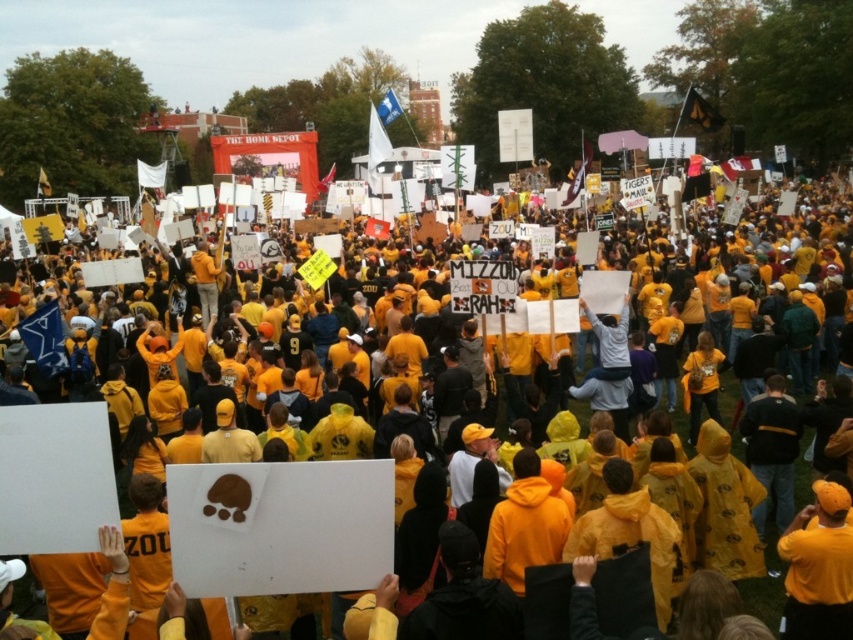
Is yellow matte raincoat at center bigger than light gray sweater at center?

Yes.

This screenshot has height=640, width=853. Describe the element at coordinates (759, 387) in the screenshot. I see `yellow matte raincoat at center` at that location.

Between point (810, 212) and point (611, 374), which one is positioned behind?

Point (810, 212)

At what (x,y) coordinates should I click in order to perform the action: click on yellow matte raincoat at center. Please return your answer as a coordinate pair (x, y). The width and height of the screenshot is (853, 640). Looking at the image, I should click on (759, 387).